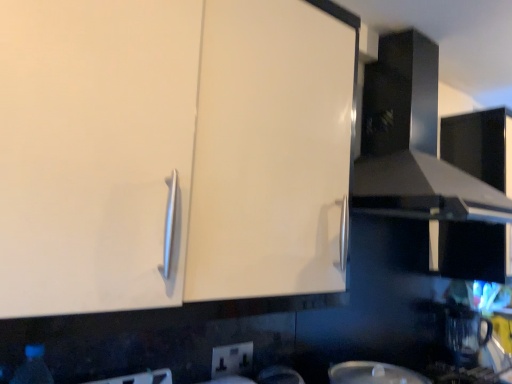
Question: Considering the relative positions of white plastic electric outlet at lower center and white glossy cabinet at upper left in the image provided, is white plastic electric outlet at lower center to the right of white glossy cabinet at upper left from the viewer's perspective?

Choices:
 (A) yes
 (B) no

Answer: (A)

Question: From a real-world perspective, is white plastic electric outlet at lower center beneath white glossy cabinet at upper left?

Choices:
 (A) no
 (B) yes

Answer: (B)

Question: Can you confirm if white plastic electric outlet at lower center is taller than white glossy cabinet at upper left?

Choices:
 (A) no
 (B) yes

Answer: (A)

Question: Considering the relative sizes of white plastic electric outlet at lower center and white glossy cabinet at upper left in the image provided, is white plastic electric outlet at lower center shorter than white glossy cabinet at upper left?

Choices:
 (A) no
 (B) yes

Answer: (B)

Question: Does white plastic electric outlet at lower center come behind white glossy cabinet at upper left?

Choices:
 (A) yes
 (B) no

Answer: (A)

Question: From the image's perspective, does white plastic electric outlet at lower center appear lower than white glossy cabinet at upper left?

Choices:
 (A) no
 (B) yes

Answer: (B)

Question: Are transparent plastic bottle at lower left and white plastic electric outlet at lower center beside each other?

Choices:
 (A) yes
 (B) no

Answer: (B)

Question: Is the position of transparent plastic bottle at lower left more distant than that of white plastic electric outlet at lower center?

Choices:
 (A) yes
 (B) no

Answer: (B)

Question: From the image's perspective, is transparent plastic bottle at lower left located above white plastic electric outlet at lower center?

Choices:
 (A) yes
 (B) no

Answer: (A)

Question: From a real-world perspective, is transparent plastic bottle at lower left below white plastic electric outlet at lower center?

Choices:
 (A) no
 (B) yes

Answer: (B)

Question: Is transparent plastic bottle at lower left positioned with its back to white plastic electric outlet at lower center?

Choices:
 (A) no
 (B) yes

Answer: (A)

Question: From the image's perspective, does transparent plastic bottle at lower left appear lower than white plastic electric outlet at lower center?

Choices:
 (A) no
 (B) yes

Answer: (A)

Question: Is there a large distance between transparent plastic bottle at lower left and transparent plastic coffee machine at lower right?

Choices:
 (A) yes
 (B) no

Answer: (A)